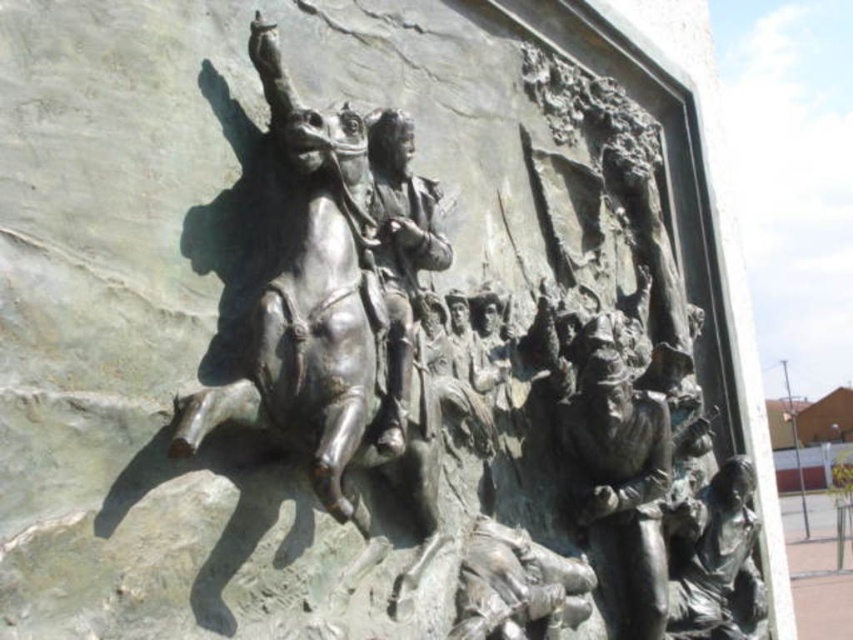
Is the position of bronze sculpture at center more distant than that of bronze figure at center?

That is False.

Can you confirm if bronze sculpture at center is wider than bronze figure at center?

Yes, bronze sculpture at center is wider than bronze figure at center.

Between point (612, 212) and point (412, 230), which one is positioned behind?

Point (612, 212)

Where is `bronze sculpture at center`? This screenshot has height=640, width=853. bronze sculpture at center is located at coordinates (500, 369).

Where is `bronze sculpture at center`? The image size is (853, 640). bronze sculpture at center is located at coordinates (500, 369).

Between point (437, 484) and point (556, 403), which one is positioned behind?

The point (556, 403) is more distant.

You are a GUI agent. You are given a task and a screenshot of the screen. Output one action in this format:
    pyautogui.click(x=<x>, y=<y>)
    Task: Click on the bronze sculpture at center
    The height and width of the screenshot is (640, 853).
    Given the screenshot: What is the action you would take?
    pyautogui.click(x=500, y=369)

Does bronze sculpture at center appear over bronze horseman at center?

No, bronze sculpture at center is not above bronze horseman at center.

Is bronze sculpture at center to the left of bronze horseman at center from the viewer's perspective?

No, bronze sculpture at center is not to the left of bronze horseman at center.

Find the location of a particular element. This screenshot has height=640, width=853. bronze sculpture at center is located at coordinates (500, 369).

Where is `bronze sculpture at center`? bronze sculpture at center is located at coordinates (500, 369).